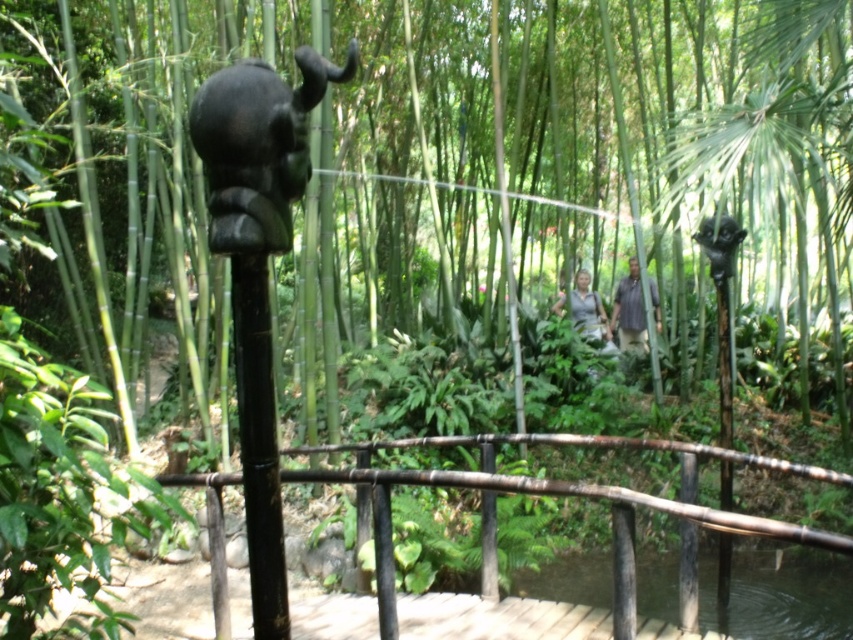
Based on the photo, you are a visitor standing on the wooden bridge and want to take a photo of the dark brown bamboo rail at center and the black glossy elephant at upper center. Which object should you focus on first if you want to capture both in the frame without moving the camera?

The dark brown bamboo rail at center is positioned on the right side of the black glossy elephant at upper center, so you should focus on the black glossy elephant at upper center first to ensure both are in the frame without moving the camera.

You are a visitor walking on the wooden bridge in the tropical garden. You notice the dark brown bamboo rail at center and the green textured shirt at center. Which object is closer to you as you look down from the bridge?

The dark brown bamboo rail at center is positioned under the green textured shirt at center, so when looking down from the bridge, the dark brown bamboo rail at center would be closer to you since it is beneath the shirt.